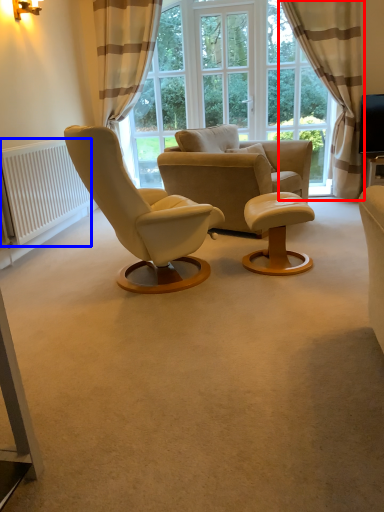
Question: Which object appears farthest to the camera in this image, curtain (highlighted by a red box) or radiator (highlighted by a blue box)?

Choices:
 (A) curtain
 (B) radiator

Answer: (A)